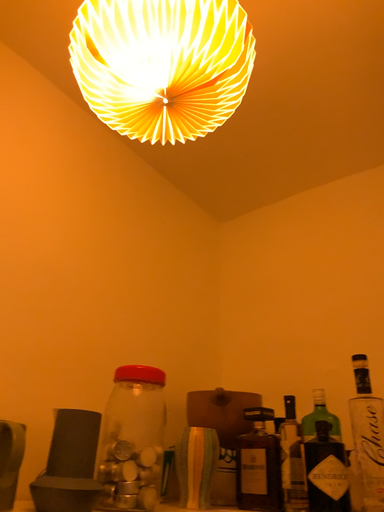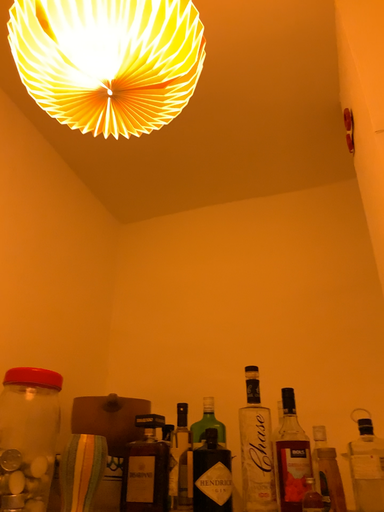
Question: Which way did the camera rotate in the video?

Choices:
 (A) rotated right
 (B) rotated left

Answer: (A)